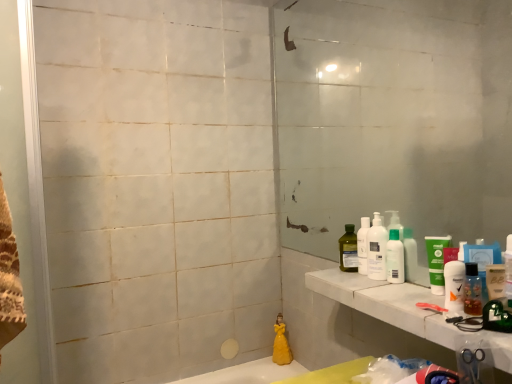
Locate an element on the screen. This screenshot has width=512, height=384. vacant space in front of white plastic bottles at right, acting as the second cleaning product starting from the bottom is located at coordinates (402, 288).